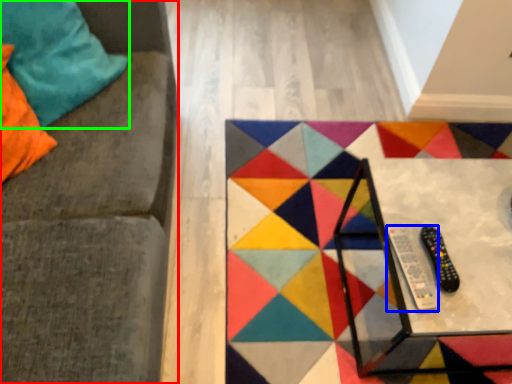
Question: Based on their relative distances, which object is nearer to furniture (highlighted by a red box)? Choose from remote (highlighted by a blue box) and pillow (highlighted by a green box).

Choices:
 (A) remote
 (B) pillow

Answer: (B)